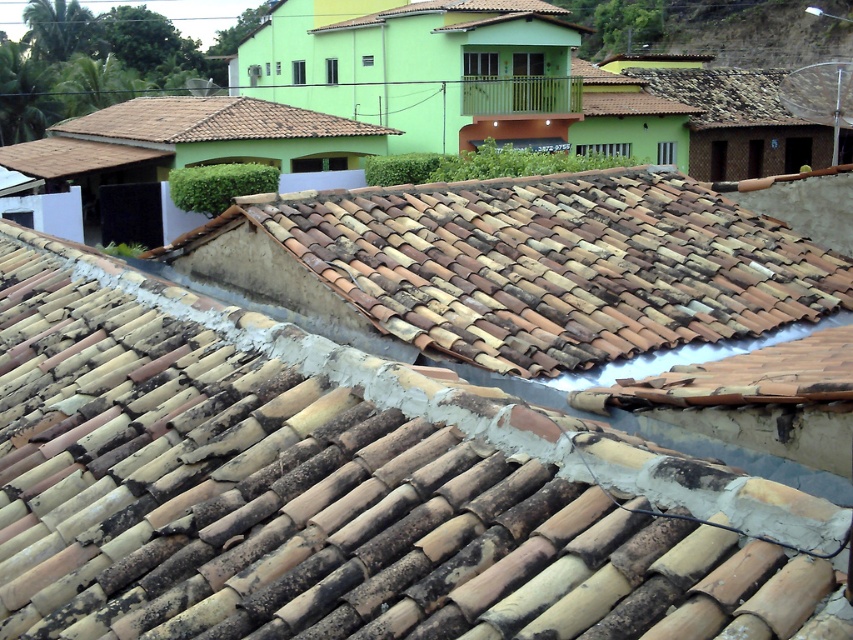
Question: Is brown weathered tiles at center bigger than brown clay tiles at center?

Choices:
 (A) no
 (B) yes

Answer: (B)

Question: Among these objects, which one is nearest to the camera?

Choices:
 (A) brown clay tiles at center
 (B) brown weathered tiles at center
 (C) brown tile roof at upper left

Answer: (B)

Question: Can you confirm if brown weathered tiles at center is thinner than brown tile roof at upper left?

Choices:
 (A) no
 (B) yes

Answer: (B)

Question: Estimate the real-world distances between objects in this image. Which object is closer to the brown weathered tiles at center?

Choices:
 (A) brown tile roof at upper left
 (B) brown clay tiles at center

Answer: (B)

Question: Which point is closer to the camera?

Choices:
 (A) brown weathered tiles at center
 (B) brown tile roof at upper left

Answer: (A)

Question: Can you confirm if brown weathered tiles at center is wider than brown clay tiles at center?

Choices:
 (A) yes
 (B) no

Answer: (A)